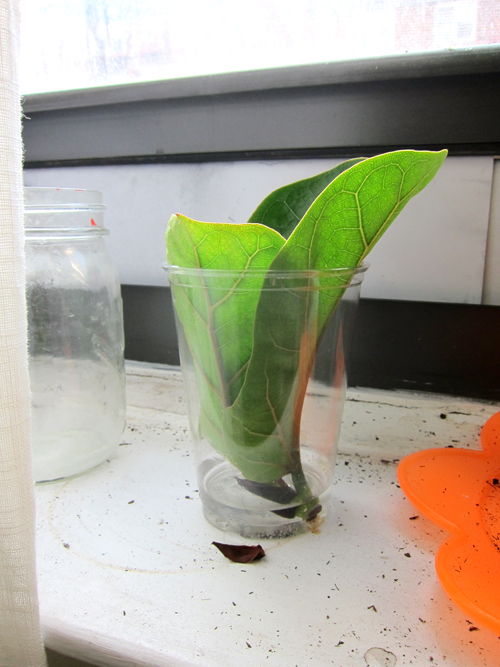
Where is `cup`? cup is located at coordinates (267, 475).